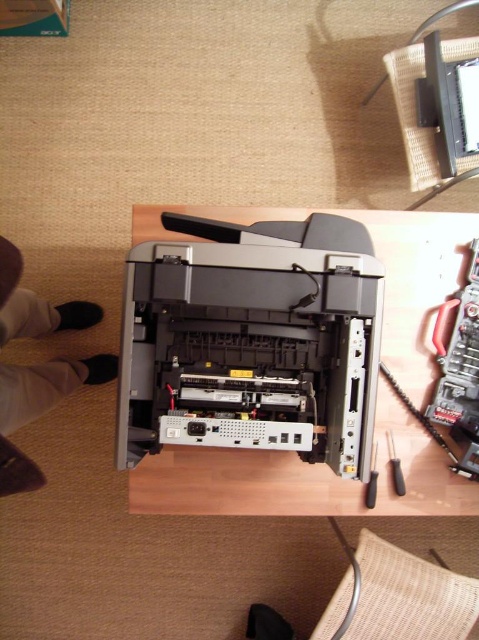
You are a technician working on the black plastic printer at center. You need to reach for a screwdriver that is 30.97 inches away. Can you comfortably reach it without moving your body?

The screwdriver is 30.97 inches away from the black plastic printer at center. The average human arm length is about 25 to 30 inches, so reaching 30.97 inches might be slightly challenging but possible if you stretch your arm fully.

You are a technician who needs to access the black plastic screwdriver at lower right to fix the printer. However, the white fabric pants at lower left are blocking the way. Can you reach the screwdriver without moving the pants?

The white fabric pants at lower left is in front of the black plastic screwdriver at lower right, so you cannot reach the screwdriver without moving the pants.

You are a technician working on the printer. You need to reach for the black plastic screwdriver at lower right to fix the black plastic printer at center. Which object is closer to you?

The black plastic printer at center is closer to the viewer than the black plastic screwdriver at lower right, so you will need to reach past the printer to get the screwdriver.